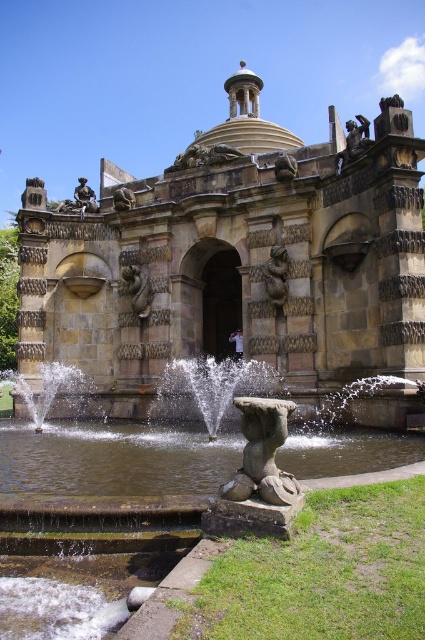
You are an architect visiting this historical site. You need to determine which of the two objects, the stone statue at center or the brown stone lion at center, is bigger. Based on the scene description, which one is larger?

The stone statue at center has a larger size compared to the brown stone lion at center, so the stone statue at center is bigger.

You are standing at the center of the image and want to walk to the green mossy stone fountain at lower left. Which direction should you move in?

The green mossy stone fountain at lower left is located at coordinates approximately 0.717 on the x axis and 0.261 on the y axis. Since you are at the center, you should move towards the lower left direction to reach it.

You are an architect designing a new plaza and want to ensure the new water feature is wider than the central building. Based on the scene, will the clear water at fountain center be wider than the brown stone palace at center?

The brown stone palace at center is wider than the clear water at fountain center, so the water feature is not wider than the central building in the scene.